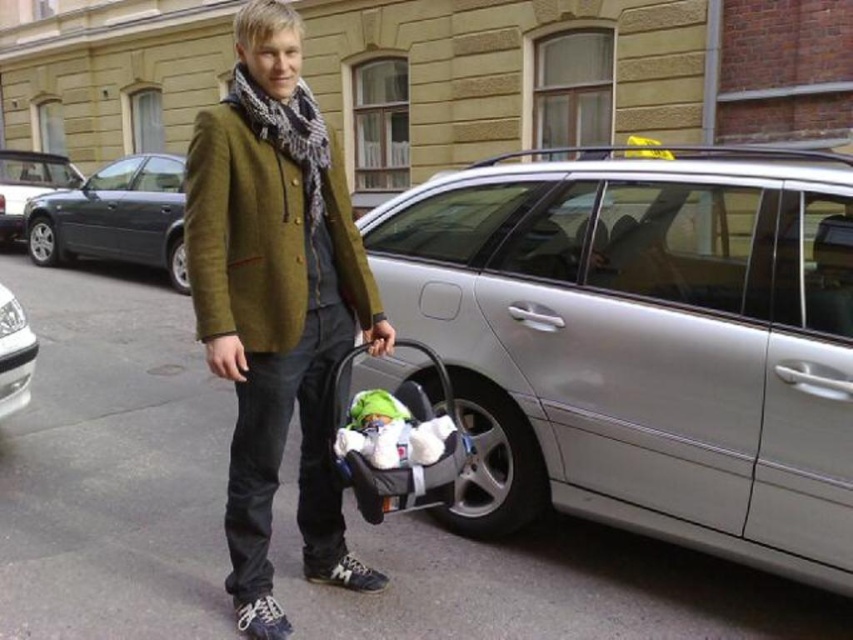
You are a delivery person who needs to place the silver metallic car at right and the soft fabric baby carriage at lower center into a storage room. The storage room has a height limit of 1.5 meters. Which object might not fit due to its height?

The silver metallic car at right is much taller than the soft fabric baby carriage at lower center, so it might not fit in the storage room with the 1.5 meters height limit.

Looking at this image, you are a pedestrian on the street and see the metallic gray sedan at left and the white glossy car at left. Which one is positioned further to the left side of the street?

The metallic gray sedan at left is positioned further to the left side of the street than the white glossy car at left.